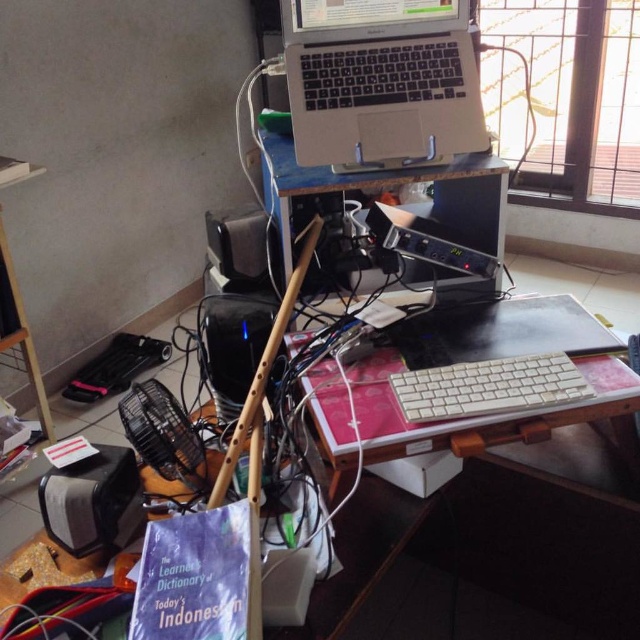
You are organizing your desk and need to move the white plastic keyboard at center to the left side. However, there is a black plastic speaker at center in the way. Can you move the keyboard without moving the speaker?

The white plastic keyboard at center is in front of the black plastic speaker at center, so you can move the keyboard without moving the speaker since it is already in front and not obstructed by it.

You are setting up a home theater system and need to place two black plastic speakers. The larger speaker needs to be placed in the center for surround sound, while the smaller one should be positioned to the lower left. Based on the image, are the black plastic speaker at lower left and black plastic speaker at center placed correctly according to your setup requirements?

The black plastic speaker at lower left has a smaller size compared to black plastic speaker at center, so yes, they are placed correctly as the smaller one is at the lower left and the larger one is at the center, matching the setup requirements.